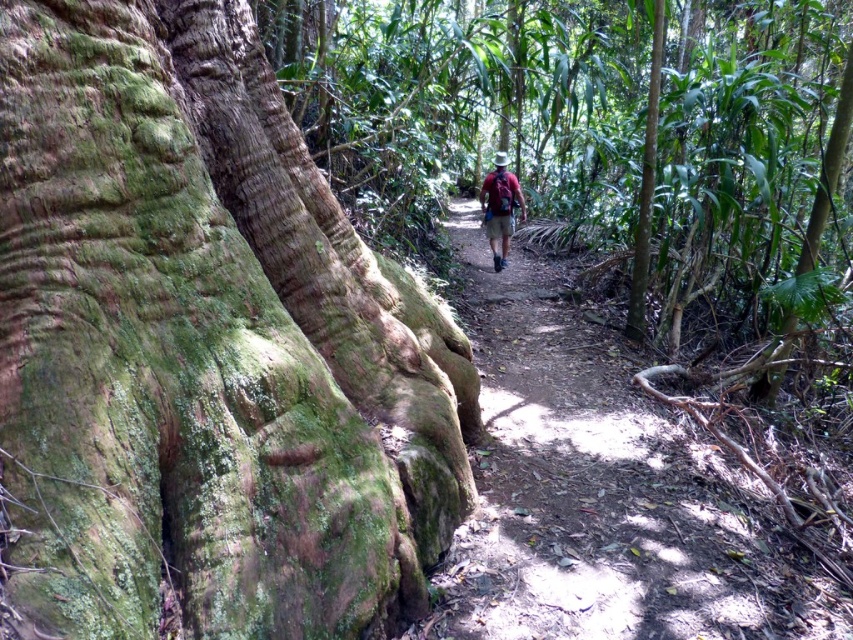
Question: Which point appears closest to the camera in this image?

Choices:
 (A) (508, 172)
 (B) (503, 502)

Answer: (B)

Question: From the image, what is the correct spatial relationship of brown dirt trail at center in relation to maroon fabric backpack at center?

Choices:
 (A) right
 (B) left

Answer: (A)

Question: Does brown dirt trail at center appear on the left side of maroon fabric backpack at center?

Choices:
 (A) no
 (B) yes

Answer: (A)

Question: Is brown dirt trail at center smaller than maroon fabric backpack at center?

Choices:
 (A) yes
 (B) no

Answer: (A)